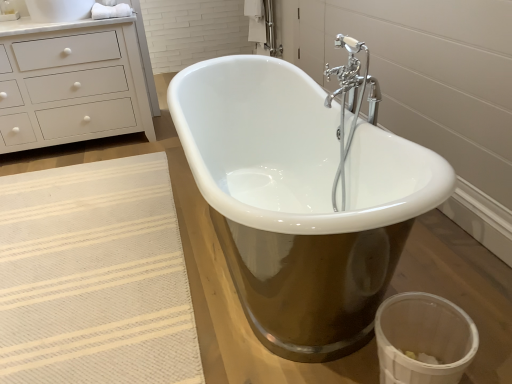
Question: Is point (150, 155) positioned closer to the camera than point (22, 48)?

Choices:
 (A) farther
 (B) closer

Answer: (A)

Question: Relative to white matte chest of drawers at upper left, is beige woven rug at lower left in front or behind?

Choices:
 (A) front
 (B) behind

Answer: (A)

Question: Which is nearer to the transparent plastic toilet bowl at lower right?

Choices:
 (A) beige woven rug at lower left
 (B) white matte chest of drawers at upper left
 (C) white cotton towel at upper left
 (D) white glossy bathtub at center

Answer: (D)

Question: Based on their relative distances, which object is farther from the white glossy bathtub at center?

Choices:
 (A) white cotton towel at upper left
 (B) white matte chest of drawers at upper left
 (C) beige woven rug at lower left
 (D) transparent plastic toilet bowl at lower right

Answer: (A)